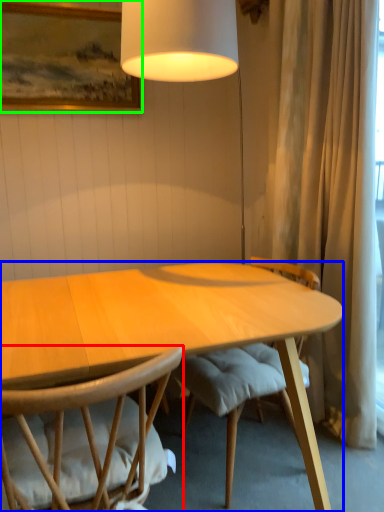
Question: Which object is positioned closest to chair (highlighted by a red box)? Select from desk (highlighted by a blue box) and picture frame (highlighted by a green box).

Choices:
 (A) desk
 (B) picture frame

Answer: (A)